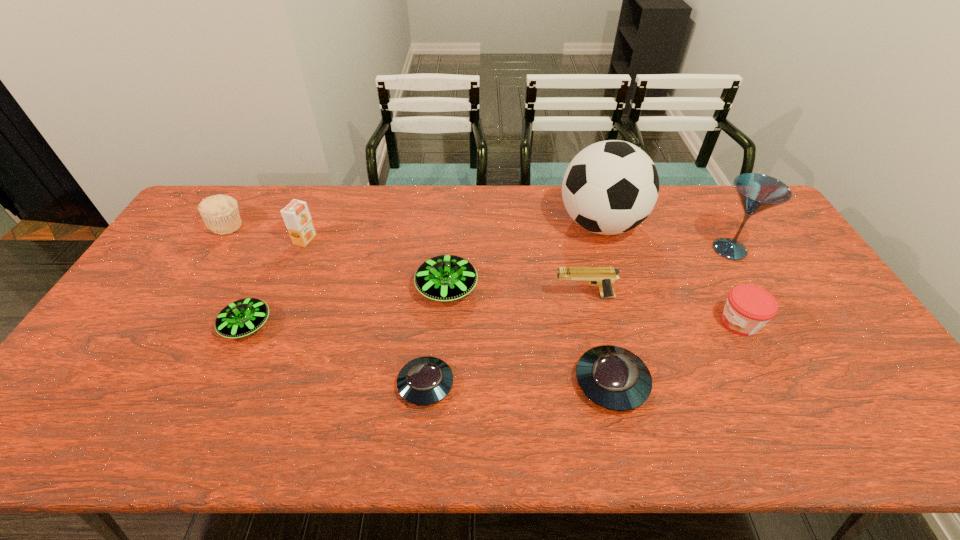
You are a GUI agent. You are given a task and a screenshot of the screen. Output one action in this format:
    pyautogui.click(x=<x>, y=<y>)
    Task: Click on the seventh closest object to the orange juice
    Image resolution: width=960 pixels, height=540 pixels.
    Given the screenshot: What is the action you would take?
    pyautogui.click(x=614, y=378)

The height and width of the screenshot is (540, 960). I want to click on object that can be found as the ninth closest to the tallest object, so click(x=220, y=213).

Point out which saucer is positioned as the fourth nearest to the jam. Please provide its 2D coordinates. Your answer should be formatted as a tuple, i.e. [(x, y)], where the tuple contains the x and y coordinates of a point satisfying the conditions above.

[(243, 317)]

Locate an element on the screen. The width and height of the screenshot is (960, 540). saucer that is the closest one to the black soccer ball is located at coordinates (444, 278).

This screenshot has height=540, width=960. What are the coordinates of `free space in the image that satisfies the following two spatial constraints: 1. on the front side of the martini; 2. on the left side of the tallest object` in the screenshot? It's located at (608, 249).

This screenshot has height=540, width=960. I want to click on free spot that satisfies the following two spatial constraints: 1. on the back side of the tallest object; 2. on the left side of the left green saucer, so click(294, 225).

You are a GUI agent. You are given a task and a screenshot of the screen. Output one action in this format:
    pyautogui.click(x=<x>, y=<y>)
    Task: Click on the free spot that satisfies the following two spatial constraints: 1. at the barrel of the pistol; 2. on the left side of the rightmost saucer
    This screenshot has height=540, width=960.
    Given the screenshot: What is the action you would take?
    pyautogui.click(x=603, y=382)